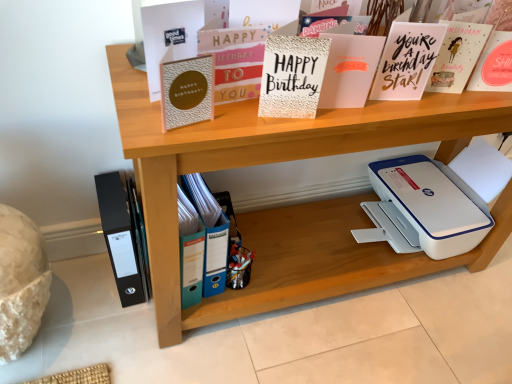
You are a GUI agent. You are given a task and a screenshot of the screen. Output one action in this format:
    pyautogui.click(x=<x>, y=<y>)
    Task: Click on the free space in front of matte gold card at center, which is the 3th paperback book in right-to-left order
    
    Given the screenshot: What is the action you would take?
    pyautogui.click(x=326, y=121)